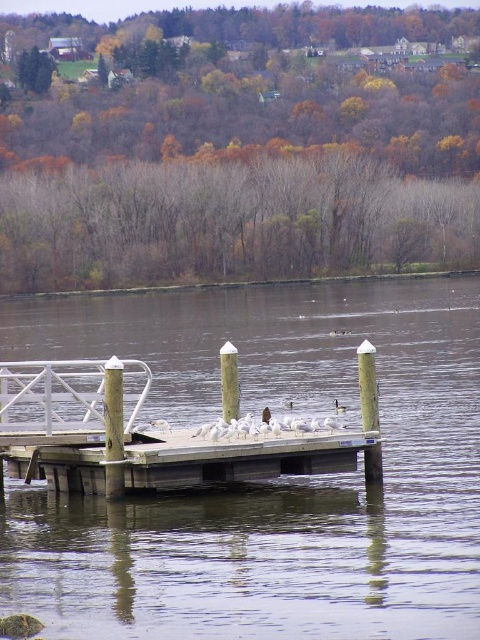
Can you confirm if transparent wooden dock at center is shorter than wooden dock at center?

Incorrect, transparent wooden dock at center's height does not fall short of wooden dock at center's.

Who is higher up, transparent wooden dock at center or wooden dock at center?

Positioned higher is transparent wooden dock at center.

Image resolution: width=480 pixels, height=640 pixels. Identify the location of transparent wooden dock at center. (269, 480).

Can you confirm if transparent wooden dock at center is shorter than smooth gray post at center?

No, transparent wooden dock at center is not shorter than smooth gray post at center.

Is transparent wooden dock at center positioned in front of smooth gray post at center?

That is True.

Where is `transparent wooden dock at center`? transparent wooden dock at center is located at coordinates (269, 480).

Does point (118, 465) come behind point (235, 349)?

No, (118, 465) is in front of (235, 349).

Is point (120, 435) positioned in front of point (233, 401)?

Yes, point (120, 435) is in front of point (233, 401).

Identify the location of white painted wood post at center. The width and height of the screenshot is (480, 640). (113, 428).